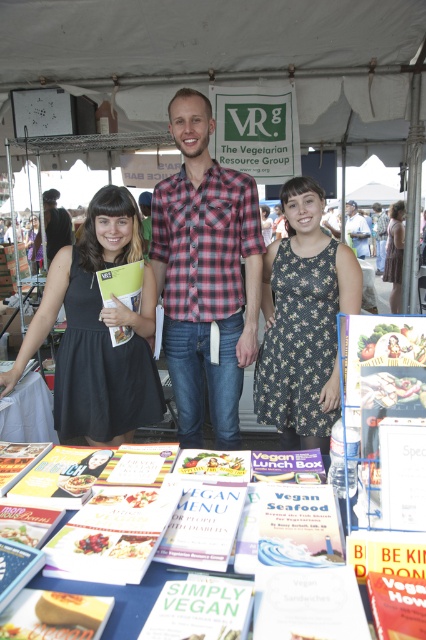
Who is positioned more to the right, red plaid shirt at center or smooth red berries at center?

Positioned to the right is red plaid shirt at center.

Is point (241, 307) behind point (94, 548)?

Yes, it is behind point (94, 548).

Measure the distance between red plaid shirt at center and camera.

7.24 feet

What are the coordinates of `red plaid shirt at center` in the screenshot? It's located at (206, 275).

Which is above, matte black shirt at center or plaid flannel shirt at center?

plaid flannel shirt at center is above.

Who is more distant from viewer, (68,230) or (351,212)?

Point (351,212)

The image size is (426, 640). What are the coordinates of `matte black shirt at center` in the screenshot? It's located at (54, 224).

Is the position of white paper book at center less distant than that of white paper book at lower left?

That is True.

You are a GUI agent. You are given a task and a screenshot of the screen. Output one action in this format:
    pyautogui.click(x=<x>, y=<y>)
    Task: Click on the white paper book at center
    
    Given the screenshot: What is the action you would take?
    pyautogui.click(x=132, y=547)

Locate an element on the screen. white paper book at center is located at coordinates (132, 547).